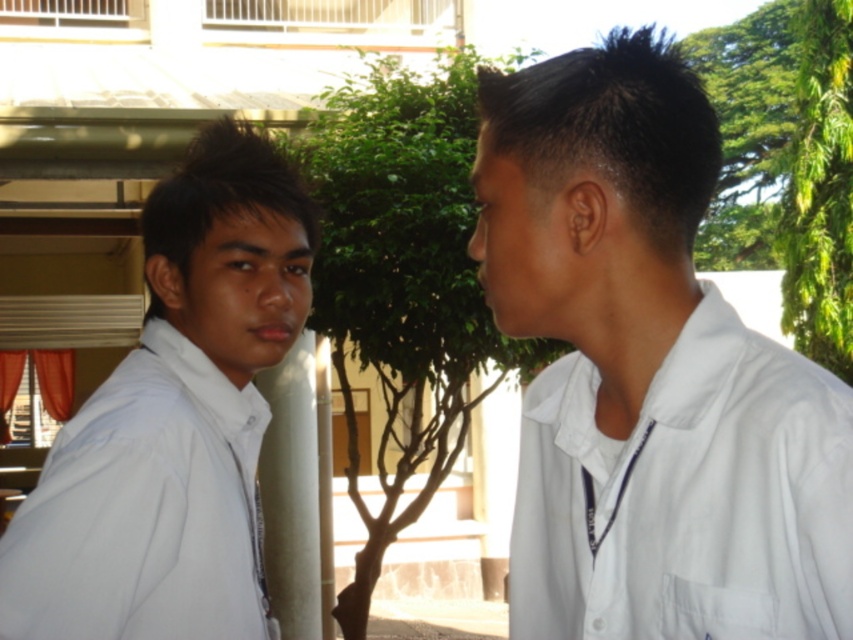
Question: Does white matte shirt at center appear on the left side of white matte shirt at left?

Choices:
 (A) yes
 (B) no

Answer: (B)

Question: Among these objects, which one is farthest from the camera?

Choices:
 (A) white matte shirt at left
 (B) white matte shirt at center

Answer: (A)

Question: Which point is farther from the camera taking this photo?

Choices:
 (A) (32, 627)
 (B) (590, 500)

Answer: (A)

Question: Is white matte shirt at center to the right of white matte shirt at left from the viewer's perspective?

Choices:
 (A) yes
 (B) no

Answer: (A)

Question: Does white matte shirt at center have a larger size compared to white matte shirt at left?

Choices:
 (A) yes
 (B) no

Answer: (A)

Question: Which of the following is the farthest from the observer?

Choices:
 (A) white matte shirt at center
 (B) white matte shirt at left

Answer: (B)